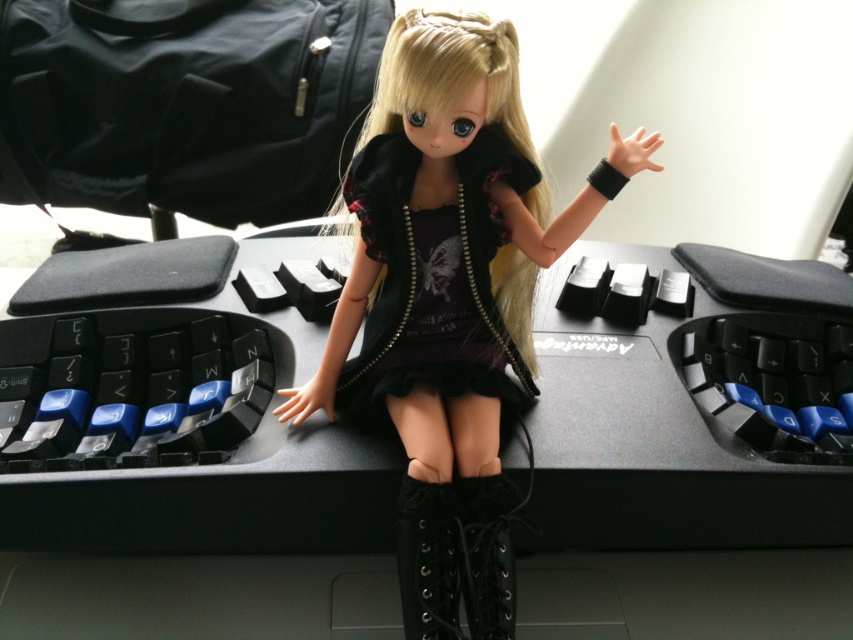
You are organizing a small event and need to place a black matte dress at center on a black matte computer desk at center. Considering their sizes, will the dress fit on the desk without hanging over the edges?

The black matte computer desk at center has a greater height compared to black matte dress at center, so the dress will fit on the desk without hanging over the edges.

You are trying to place a new monitor on the desk in the scene. The monitor requires a specific mounting bracket that must be attached to the desk at the coordinates point (184, 456). Based on the scene description, where exactly on the desk should you install the bracket?

The point (184, 456) corresponds to the black matte computer desk at center, so you should install the bracket there.

You are standing 30 inches away from the keyboard. Can you reach the point at coordinates point [495,426] without moving closer?

The distance of point [495,426] from viewer is 32.68 inches, so you are currently 30 inches away from the keyboard. Since the point is 2.68 inches further away than your current position, you cannot reach it without moving closer.